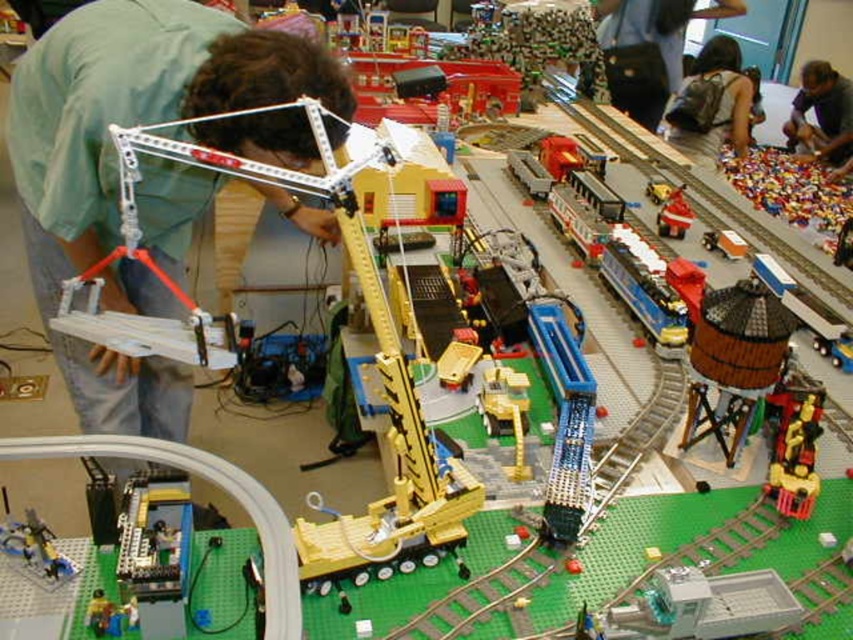
Is dark blue backpack at upper right to the right of dark brown backpack at upper right from the viewer's perspective?

In fact, dark blue backpack at upper right is to the left of dark brown backpack at upper right.

Who is taller, dark blue backpack at upper right or dark brown backpack at upper right?

dark brown backpack at upper right is taller.

Measure the distance between point (641, 28) and camera.

The distance of point (641, 28) from camera is 13.77 feet.

Locate an element on the screen. dark blue backpack at upper right is located at coordinates (651, 45).

Does dark brown backpack at upper right appear on the right side of red matte train at center?

Indeed, dark brown backpack at upper right is positioned on the right side of red matte train at center.

Is dark brown backpack at upper right closer to the viewer compared to red matte train at center?

No, dark brown backpack at upper right is further to the viewer.

Does point (728, 124) lie in front of point (669, 227)?

No, it is not.

Find the location of `dark brown backpack at upper right`. dark brown backpack at upper right is located at coordinates pos(711,102).

Does green matte shirt at upper left have a lesser height compared to dark brown backpack at upper right?

Yes, green matte shirt at upper left is shorter than dark brown backpack at upper right.

Looking at this image, between green matte shirt at upper left and dark brown backpack at upper right, which one appears on the right side from the viewer's perspective?

dark brown backpack at upper right is more to the right.

Describe the element at coordinates (132, 109) in the screenshot. Image resolution: width=853 pixels, height=640 pixels. I see `green matte shirt at upper left` at that location.

At what (x,y) coordinates should I click in order to perform the action: click on green matte shirt at upper left. Please return your answer as a coordinate pair (x, y). Looking at the image, I should click on (132, 109).